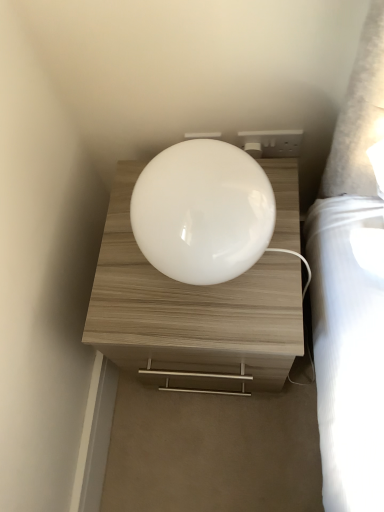
Question: Do you think white plastic socket at upper right is within white glossy nightstand at center, or outside of it?

Choices:
 (A) inside
 (B) outside

Answer: (B)

Question: Is white plastic socket at upper right to the left or to the right of white glossy nightstand at center in the image?

Choices:
 (A) left
 (B) right

Answer: (B)

Question: Which of these objects is positioned farthest from the white glossy lampshade at center?

Choices:
 (A) white plastic socket at upper right
 (B) white glossy nightstand at center

Answer: (A)

Question: Estimate the real-world distances between objects in this image. Which object is farther from the white plastic socket at upper right?

Choices:
 (A) white glossy lampshade at center
 (B) white glossy nightstand at center

Answer: (B)